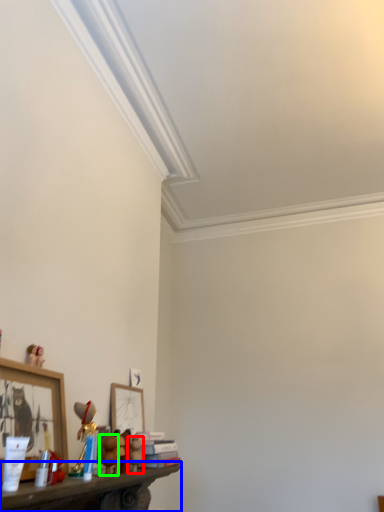
Question: Which is farther away from toy (highlighted by a red box)? shelf (highlighted by a blue box) or toy (highlighted by a green box)?

Choices:
 (A) shelf
 (B) toy

Answer: (A)